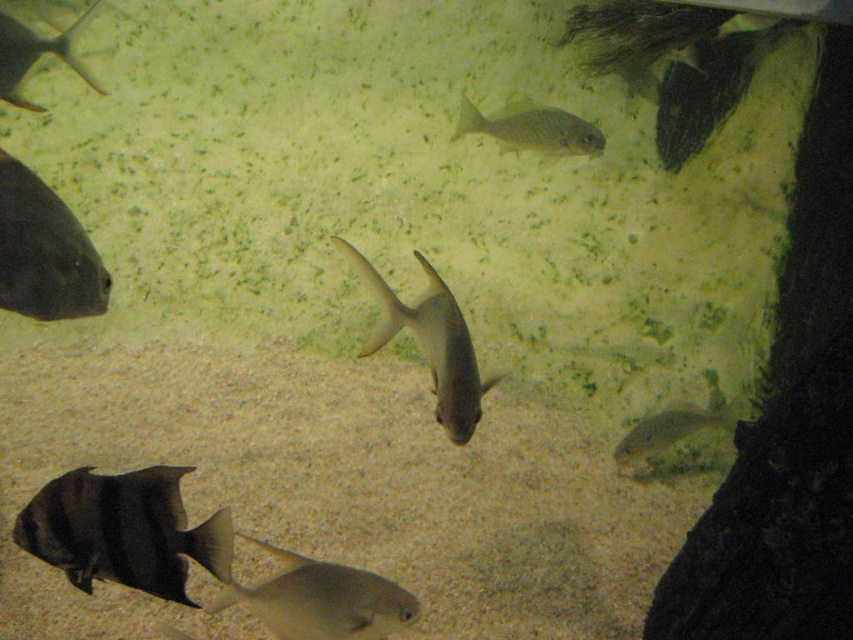
Between smooth silver fish at bottom center and shiny silver fish at upper center, which one appears on the right side from the viewer's perspective?

shiny silver fish at upper center is more to the right.

Who is more forward, (292, 596) or (555, 138)?

→ Positioned in front is point (292, 596).

The width and height of the screenshot is (853, 640). I want to click on smooth silver fish at bottom center, so click(x=321, y=600).

Can you confirm if matte black fish at left is wider than translucent gray fish at lower right?

No, matte black fish at left is not wider than translucent gray fish at lower right.

Does matte black fish at left have a smaller size compared to translucent gray fish at lower right?

Yes, matte black fish at left is smaller than translucent gray fish at lower right.

Which is behind, point (93, 304) or point (625, 442)?

Positioned behind is point (625, 442).

This screenshot has height=640, width=853. Find the location of `matte black fish at left`. matte black fish at left is located at coordinates (44, 252).

Is matte black fish at upper left bigger than translucent gray fish at lower right?

Yes.

Does matte black fish at upper left have a lesser height compared to translucent gray fish at lower right?

In fact, matte black fish at upper left may be taller than translucent gray fish at lower right.

Does point (59, 56) lie behind point (637, 452)?

No, (59, 56) is in front of (637, 452).

This screenshot has width=853, height=640. I want to click on matte black fish at upper left, so pyautogui.click(x=35, y=54).